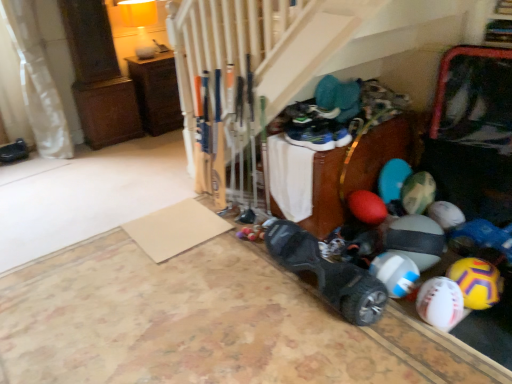
Question: In terms of height, does white fabric curtain at left look taller or shorter compared to yellow matte beach ball at lower right, the 3th beach ball in the left-to-right sequence?

Choices:
 (A) short
 (B) tall

Answer: (B)

Question: Is white fabric curtain at left bigger or smaller than yellow matte beach ball at lower right, which is counted as the 1th beach ball, starting from the right?

Choices:
 (A) big
 (B) small

Answer: (A)

Question: Which object is the farthest from the black rubber hoverboard at lower center, marked as the 1th footwear in a right-to-left arrangement?

Choices:
 (A) blue rubber beach ball at lower right, which is the 1th beach ball from left to right
 (B) brown wood cabinet at upper left
 (C) white matte beach ball at lower right, which ranks as the second beach ball in left-to-right order
 (D) black matte shoe at left, acting as the first footwear starting from the back
 (E) white fabric curtain at left

Answer: (D)

Question: Which is nearer to the black rubber hoverboard at lower center, acting as the first footwear starting from the bottom?

Choices:
 (A) brown wood cabinet at upper left
 (B) blue suede sneakers at center, which is counted as the 2th footwear, starting from the bottom
 (C) white matte beach ball at lower right, which ranks as the second beach ball in left-to-right order
 (D) black matte shoe at left, the 3th footwear ordered from the bottom
 (E) yellow matte beach ball at lower right, which is counted as the 1th beach ball, starting from the right

Answer: (C)